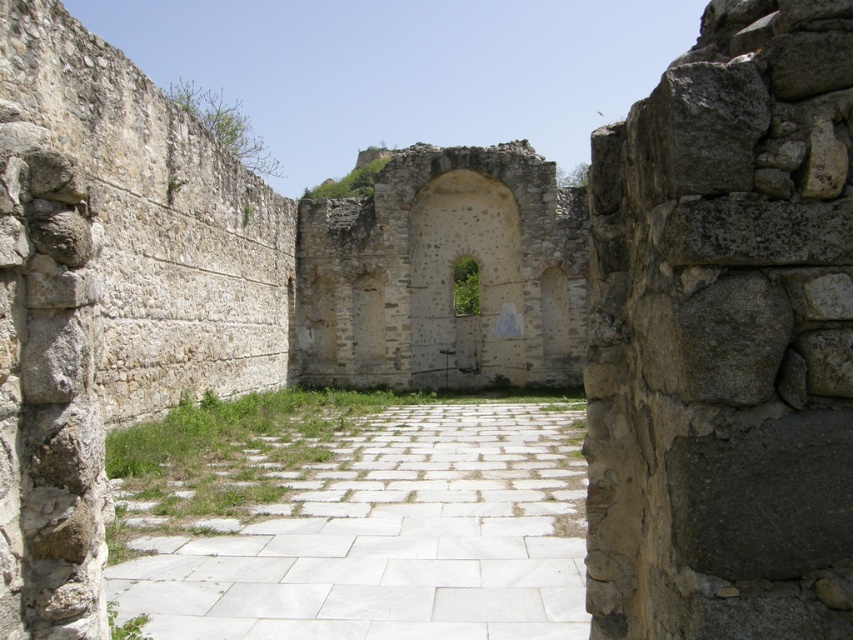
You are standing in the ancient stone structure and want to walk towards the stone textured archway at center. Is the white stone path at center leading to it elevated or lower than the archway?

The white stone path at center has a lesser height compared to the stone textured archway at center, so the path is lower than the archway.

You are an architect examining the ancient stone structure. You notice two archways at the center. One is labeled as the stone archway at center and the other as the stone textured archway at center. Which archway is taller?

The stone archway at center is taller than the stone textured archway at center according to the description.

You are an architect examining the ancient stone structure. You notice two archways at the center of the scene. One is labeled as the stone archway at center, and the other is the stone textured archway at center. Based on the description provided, which archway is wider?

The stone archway at center is wider than the stone textured archway at center according to the description.